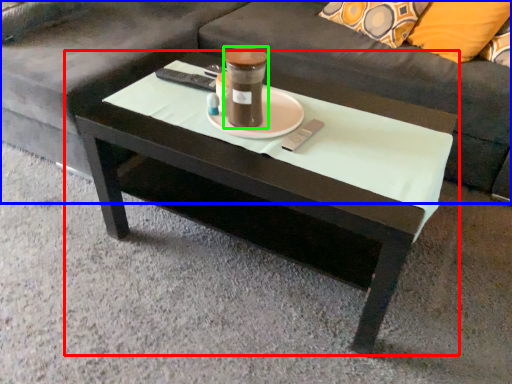
Question: Which object is positioned farthest from coffee table (highlighted by a red box)? Select from studio couch (highlighted by a blue box) and beverage (highlighted by a green box).

Choices:
 (A) studio couch
 (B) beverage

Answer: (A)